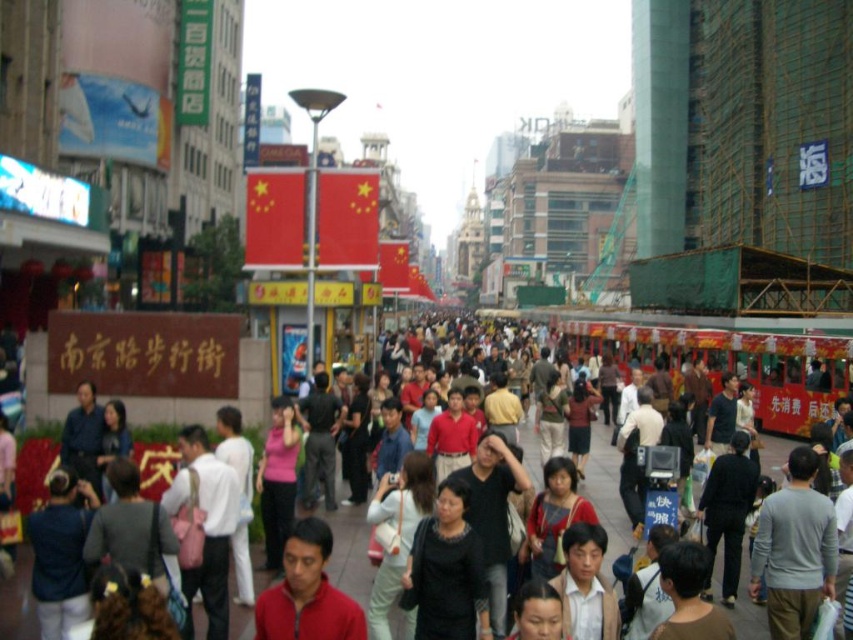
Question: Is matte black crowd at center closer to the viewer compared to matte red shirt at center?

Choices:
 (A) no
 (B) yes

Answer: (A)

Question: Which point appears farthest from the camera in this image?

Choices:
 (A) (329, 570)
 (B) (293, 592)

Answer: (A)

Question: Is matte black crowd at center above matte red shirt at center?

Choices:
 (A) no
 (B) yes

Answer: (B)

Question: Among these objects, which one is farthest from the camera?

Choices:
 (A) matte black crowd at center
 (B) matte red shirt at center

Answer: (A)

Question: Does matte black crowd at center appear under matte red shirt at center?

Choices:
 (A) no
 (B) yes

Answer: (A)